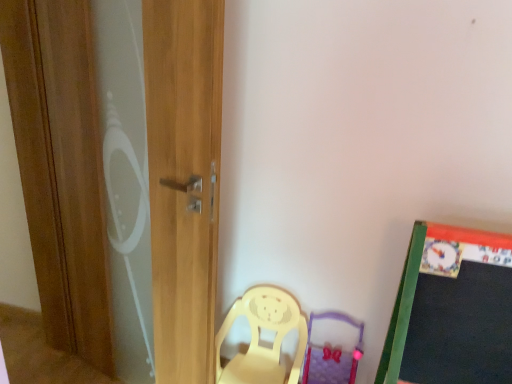
Question: Looking at their shapes, would you say purple fabric swivel chair at lower center is wider or thinner than wooden screen door at left?

Choices:
 (A) thin
 (B) wide

Answer: (B)

Question: From a real-world perspective, is purple fabric swivel chair at lower center positioned above or below wooden screen door at left?

Choices:
 (A) above
 (B) below

Answer: (B)

Question: Which is farther from the wooden screen door at left?

Choices:
 (A) yellow plastic chair at lower center
 (B) purple fabric swivel chair at lower center

Answer: (B)

Question: Considering the real-world distances, which object is closest to the yellow plastic chair at lower center?

Choices:
 (A) wooden screen door at left
 (B) purple fabric swivel chair at lower center

Answer: (B)